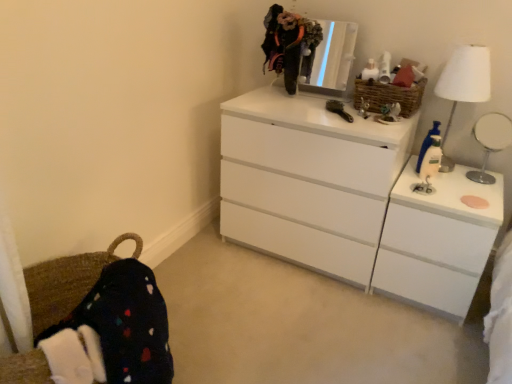
Question: Looking at the image, does white glossy file cabinet at right seem bigger or smaller compared to white glossy chest of drawers at upper right?

Choices:
 (A) big
 (B) small

Answer: (B)

Question: Relative to white glossy chest of drawers at upper right, is white glossy file cabinet at right in front or behind?

Choices:
 (A) behind
 (B) front

Answer: (B)

Question: Which object is positioned farthest from the white fabric lampshade at right?

Choices:
 (A) blue plastic bottle at right
 (B) white glossy file cabinet at right
 (C) fuzzy fabric at upper center
 (D) white glossy mirror at upper right
 (E) white glossy chest of drawers at upper right

Answer: (C)

Question: Based on their relative distances, which object is farther from the blue plastic bottle at right?

Choices:
 (A) fuzzy fabric at upper center
 (B) white glossy chest of drawers at upper right
 (C) white glossy mirror at upper right
 (D) metallic reflective mirror at upper center
 (E) white fabric lampshade at right

Answer: (A)